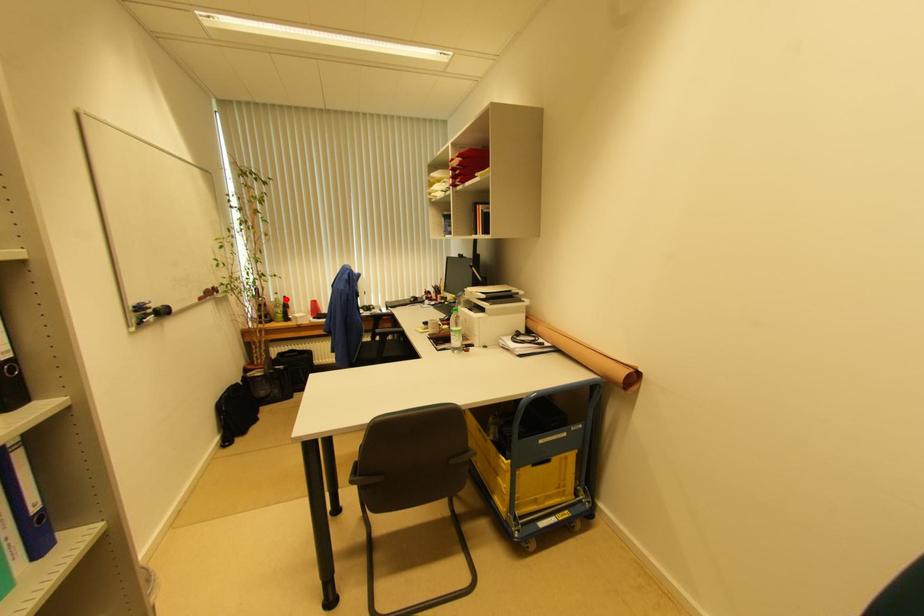
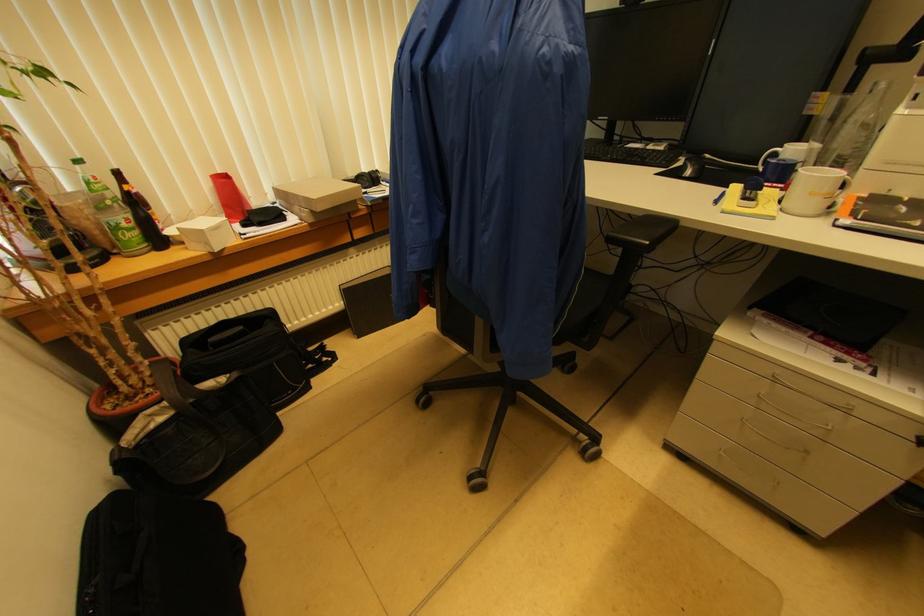
Question: I am providing you with two images of the same scene from different viewpoints. A red point is marked on the first image. At the location where the point appears in image 1, is it still visible in image 2?

Choices:
 (A) Yes
 (B) No

Answer: (A)